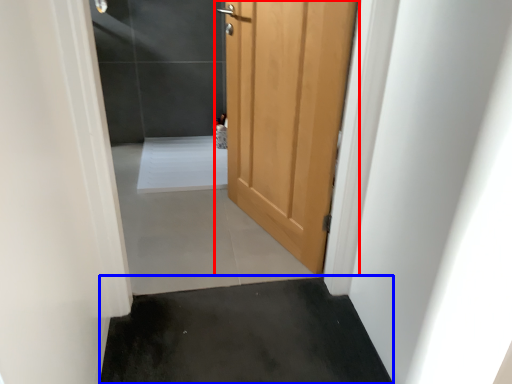
Question: Which point is closer to the camera, door (highlighted by a red box) or concrete (highlighted by a blue box)?

Choices:
 (A) door
 (B) concrete

Answer: (B)